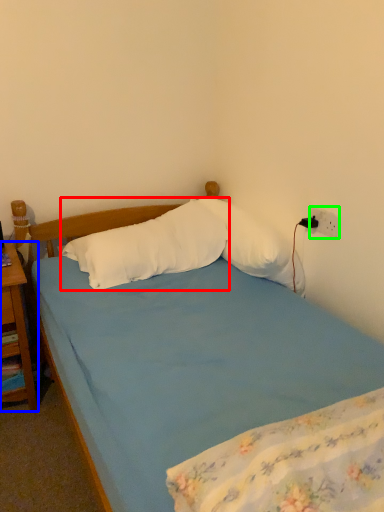
Question: Considering the real-world distances, which object is closest to pillow (highlighted by a red box)? nightstand (highlighted by a blue box) or power outlet (highlighted by a green box).

Choices:
 (A) nightstand
 (B) power outlet

Answer: (A)